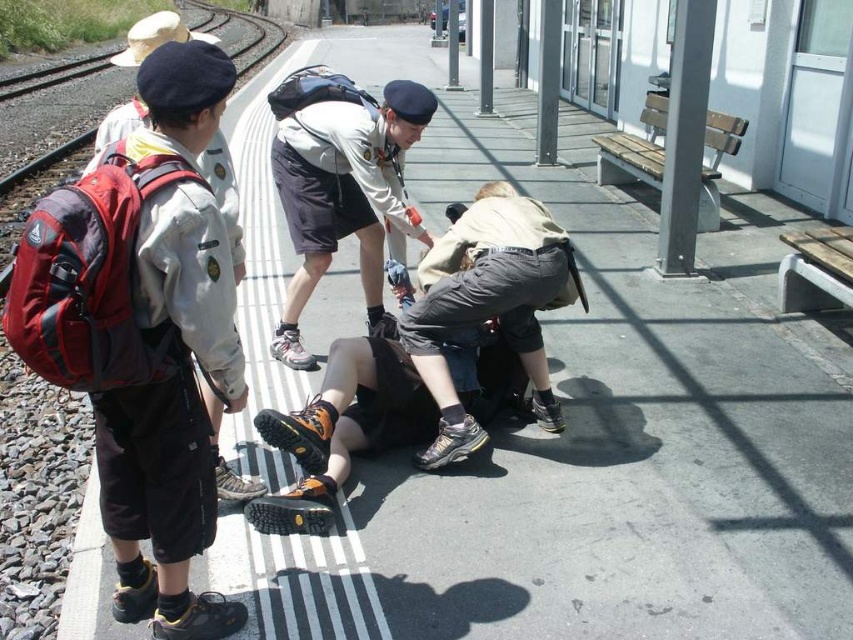
You are a pedestrian standing at point (122,60) and want to walk to point (276,102). Based on the scene description, is the destination point behind you or in front of you?

The destination point (276,102) is behind you relative to your current position at point (122,60), so it is behind you.